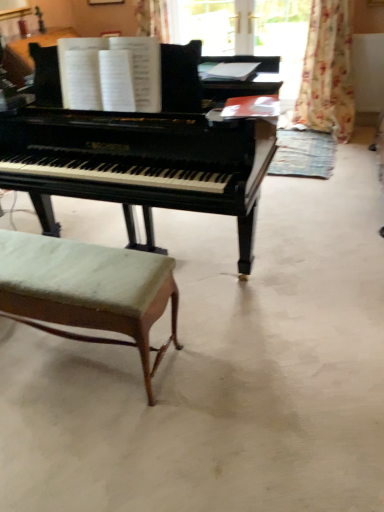
The image size is (384, 512). I want to click on vacant space in front of black polished piano at center, so click(230, 384).